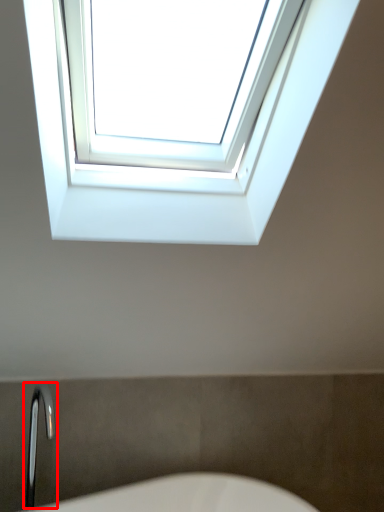
Question: From the image's perspective, what is the correct spatial positioning of faucet (annotated by the red box) in reference to window?

Choices:
 (A) below
 (B) above

Answer: (A)